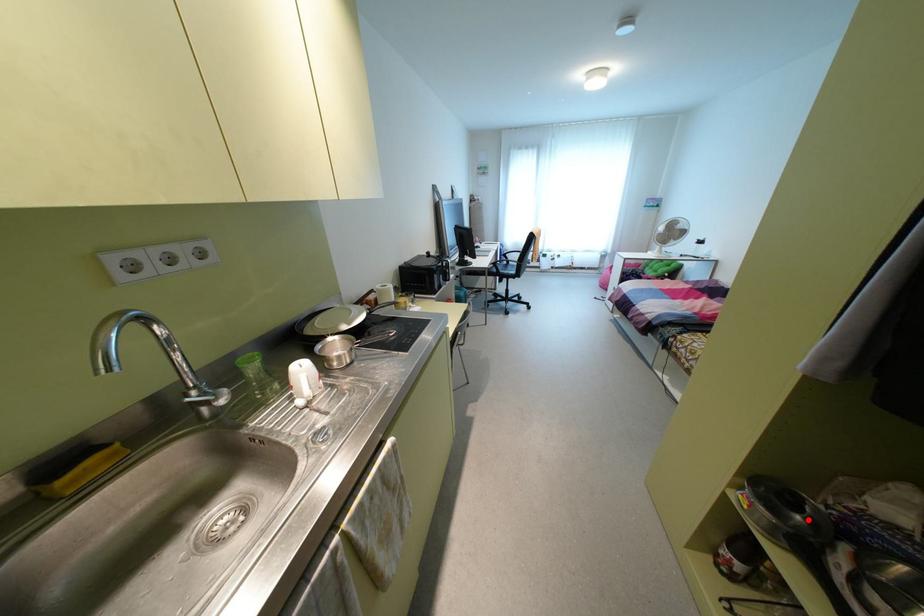
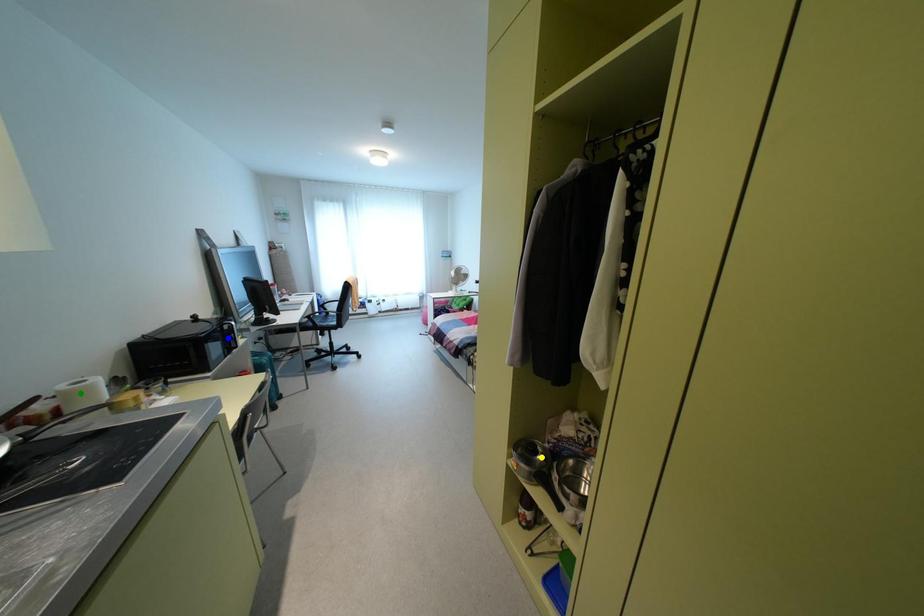
Question: I am providing you with two images of the same scene from different viewpoints. A red point is marked on the first image. You are given multiple points on the second image. Can you choose the point in image 2 that corresponds to the point in image 1?

Choices:
 (A) blue point
 (B) green point
 (C) yellow point

Answer: (C)